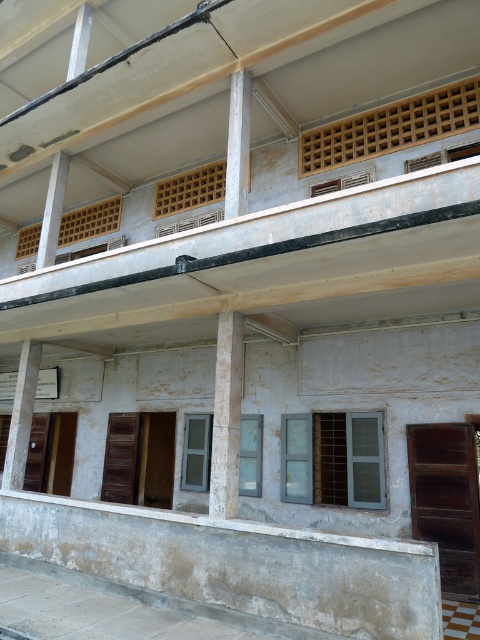
Does white concrete column at center have a larger size compared to white concrete pillar at center?

Indeed, white concrete column at center has a larger size compared to white concrete pillar at center.

Can you confirm if white concrete column at center is positioned to the right of white concrete pillar at center?

No, white concrete column at center is not to the right of white concrete pillar at center.

What do you see at coordinates (227, 417) in the screenshot?
I see `white concrete column at center` at bounding box center [227, 417].

The width and height of the screenshot is (480, 640). I want to click on white concrete column at center, so click(x=227, y=417).

Is white concrete column at center smaller than white concrete pillar at lower left?

Yes.

Does white concrete column at center have a lesser height compared to white concrete pillar at lower left?

Yes.

The image size is (480, 640). What are the coordinates of `white concrete column at center` in the screenshot? It's located at (227, 417).

Find the location of `white concrete column at center`. white concrete column at center is located at coordinates (227, 417).

Can you confirm if wooden lattice at upper center is thinner than white concrete pillar at center?

In fact, wooden lattice at upper center might be wider than white concrete pillar at center.

The width and height of the screenshot is (480, 640). What do you see at coordinates (392, 128) in the screenshot?
I see `wooden lattice at upper center` at bounding box center [392, 128].

Between point (311, 154) and point (248, 163), which one is positioned behind?

The point (311, 154) is behind.

You are a GUI agent. You are given a task and a screenshot of the screen. Output one action in this format:
    pyautogui.click(x=<x>, y=<y>)
    Task: Click on the wooden lattice at upper center
    This screenshot has width=480, height=640.
    Given the screenshot: What is the action you would take?
    pyautogui.click(x=392, y=128)